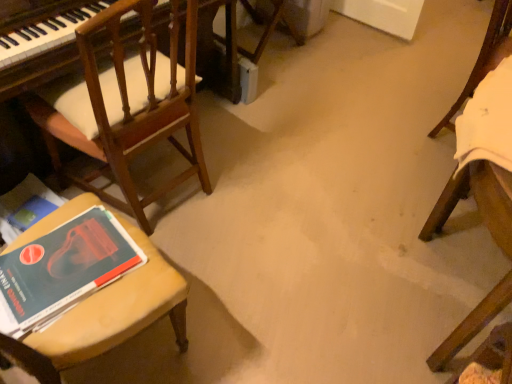
At what (x,y) coordinates should I click in order to perform the action: click on vacant area that lies between white fabric chair at right, arranged as the 1th chair when viewed from the right, and wooden chair at left, acting as the first chair starting from the left. Please return your answer as a coordinate pair (x, y). The image size is (512, 384). Looking at the image, I should click on (314, 153).